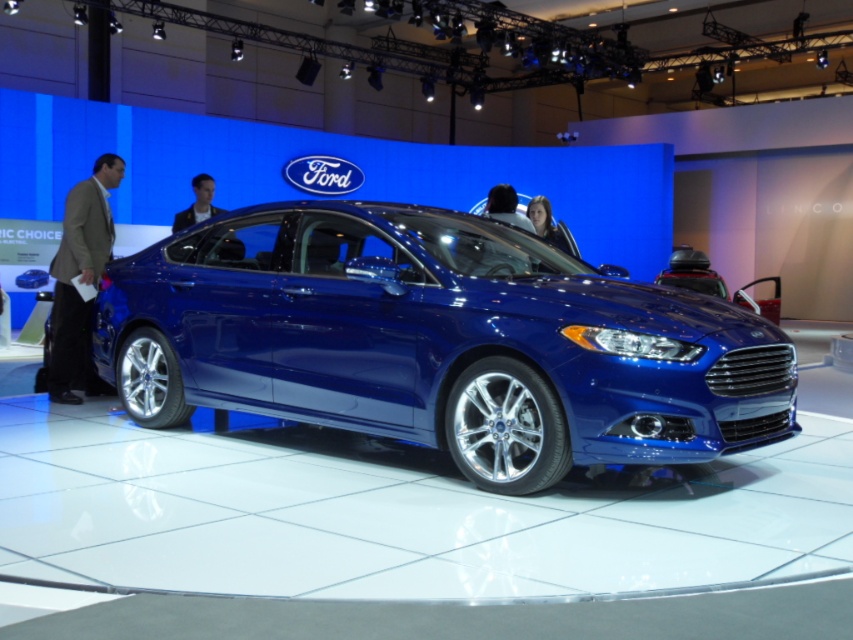
Question: Can you confirm if glossy metallic car at center is positioned above brown suit at left?

Choices:
 (A) yes
 (B) no

Answer: (B)

Question: Which of the following is the closest to the observer?

Choices:
 (A) [x=102, y=253]
 (B) [x=222, y=355]

Answer: (B)

Question: Which point is closer to the camera?

Choices:
 (A) (299, 360)
 (B) (77, 298)

Answer: (A)

Question: Does glossy metallic car at center have a lesser width compared to brown suit at left?

Choices:
 (A) yes
 (B) no

Answer: (B)

Question: Is glossy metallic car at center behind brown suit at left?

Choices:
 (A) yes
 (B) no

Answer: (B)